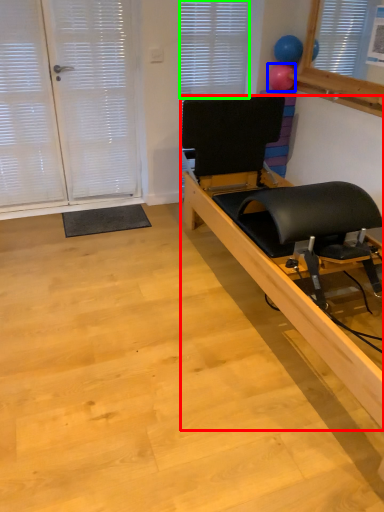
Question: Which is farther away from furniture (highlighted by a red box)? balloon (highlighted by a blue box) or blind (highlighted by a green box)?

Choices:
 (A) balloon
 (B) blind

Answer: (A)